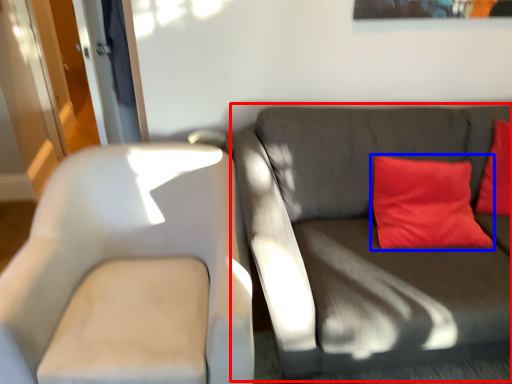
Question: Among these objects, which one is farthest to the camera, studio couch (highlighted by a red box) or pillow (highlighted by a blue box)?

Choices:
 (A) studio couch
 (B) pillow

Answer: (B)